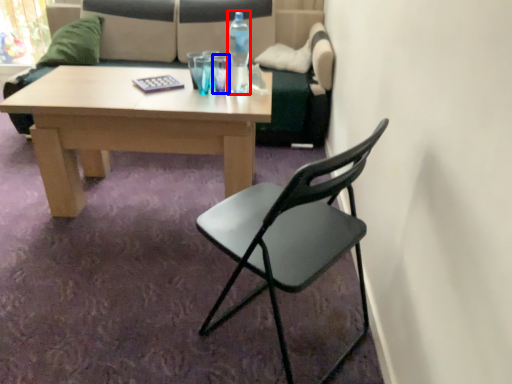
Question: Which point is closer to the camera, bottle (highlighted by a red box) or coffee cup (highlighted by a blue box)?

Choices:
 (A) bottle
 (B) coffee cup

Answer: (A)